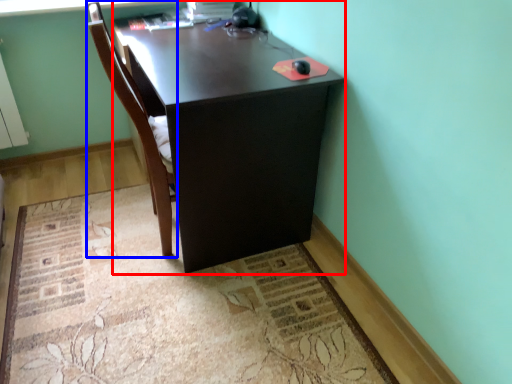
Question: Which object is closer to the camera taking this photo, desk (highlighted by a red box) or chair (highlighted by a blue box)?

Choices:
 (A) desk
 (B) chair

Answer: (B)